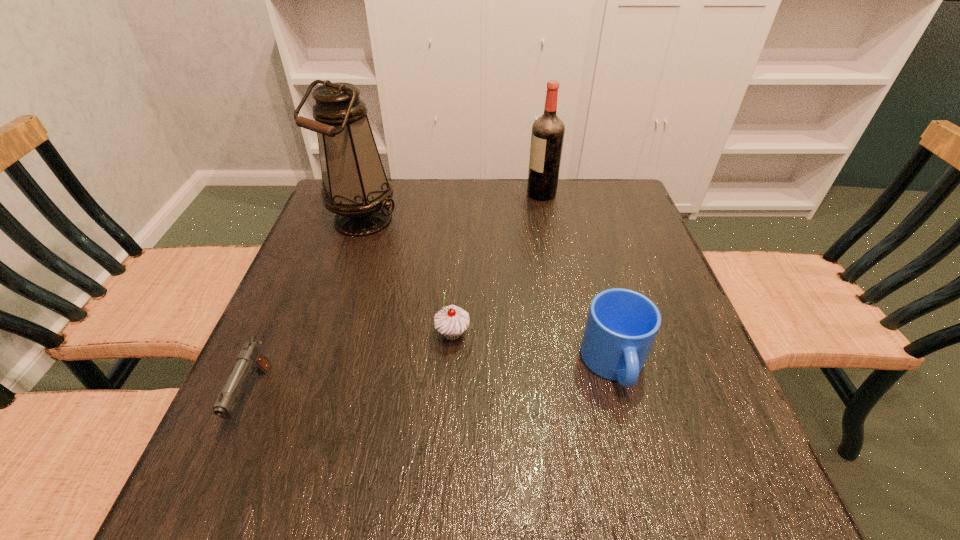
This screenshot has width=960, height=540. I want to click on free space located 0.140m on the right of the cupcake, so click(538, 334).

This screenshot has height=540, width=960. I want to click on blank space located 0.060m in the direction the shortest object is aimed, so click(222, 474).

This screenshot has width=960, height=540. I want to click on oil lamp situated at the far edge, so click(355, 187).

Locate an element on the screen. This screenshot has height=540, width=960. liquor present at the far edge is located at coordinates (547, 137).

Locate an element on the screen. The height and width of the screenshot is (540, 960). oil lamp present at the left edge is located at coordinates (355, 187).

Find the location of `gun present at the left edge`. gun present at the left edge is located at coordinates (250, 359).

Identify the location of object at the right edge. This screenshot has height=540, width=960. (622, 324).

Where is `object at the far left corner`? object at the far left corner is located at coordinates (355, 187).

Image resolution: width=960 pixels, height=540 pixels. In the image, there is a desktop. Find the location of `vacant space at the far edge`. vacant space at the far edge is located at coordinates (472, 193).

Locate an element on the screen. The height and width of the screenshot is (540, 960). free point at the near edge is located at coordinates (365, 492).